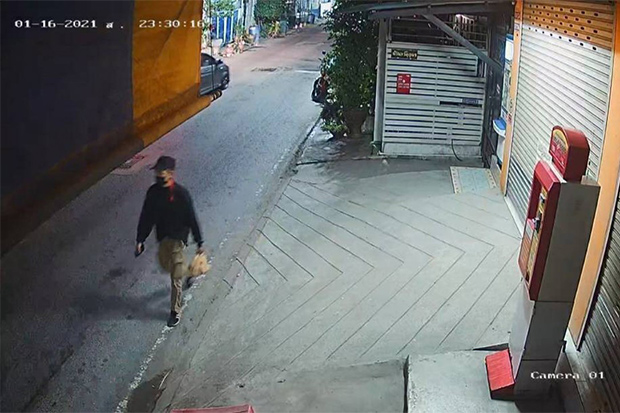
I want to click on metal door, so click(x=547, y=105), click(x=599, y=346).